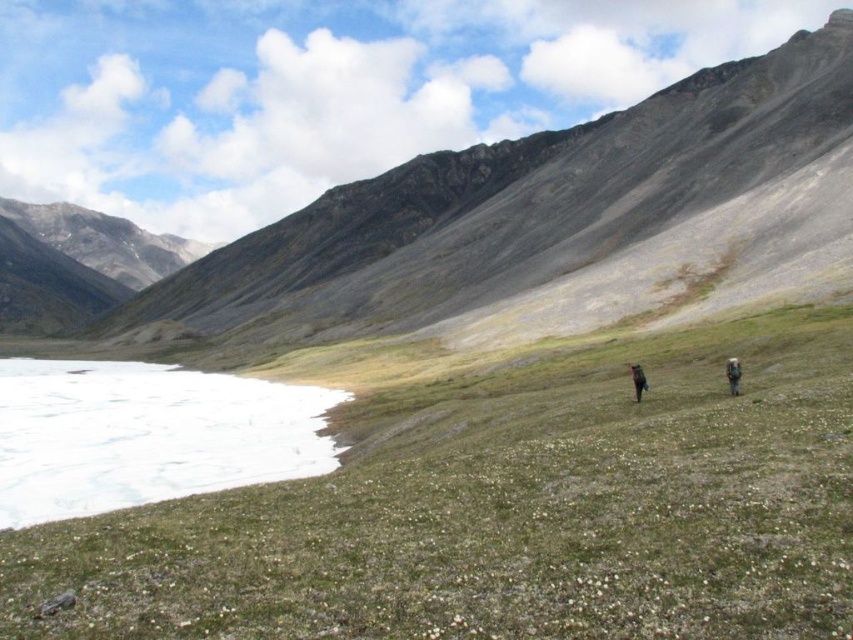
Is point (299, 403) less distant than point (637, 380)?

No.

Describe the element at coordinates (146, 435) in the screenshot. The width and height of the screenshot is (853, 640). I see `white ice at lower left` at that location.

I want to click on white ice at lower left, so click(x=146, y=435).

Is dark gray backpack at right wider than brown fabric backpack at center-right?

Correct, the width of dark gray backpack at right exceeds that of brown fabric backpack at center-right.

Is the position of dark gray backpack at right more distant than that of brown fabric backpack at center-right?

No, it is in front of brown fabric backpack at center-right.

Does point (737, 362) lie behind point (631, 381)?

No, it is not.

Find the location of a particular element. The width and height of the screenshot is (853, 640). dark gray backpack at right is located at coordinates (733, 374).

Can you confirm if white ice at lower left is positioned to the right of dark gray backpack at right?

Incorrect, white ice at lower left is not on the right side of dark gray backpack at right.

Is white ice at lower left bigger than dark gray backpack at right?

Yes.

Is point (119, 417) farther from viewer compared to point (737, 385)?

That is True.

In order to click on white ice at lower left in this screenshot , I will do `click(146, 435)`.